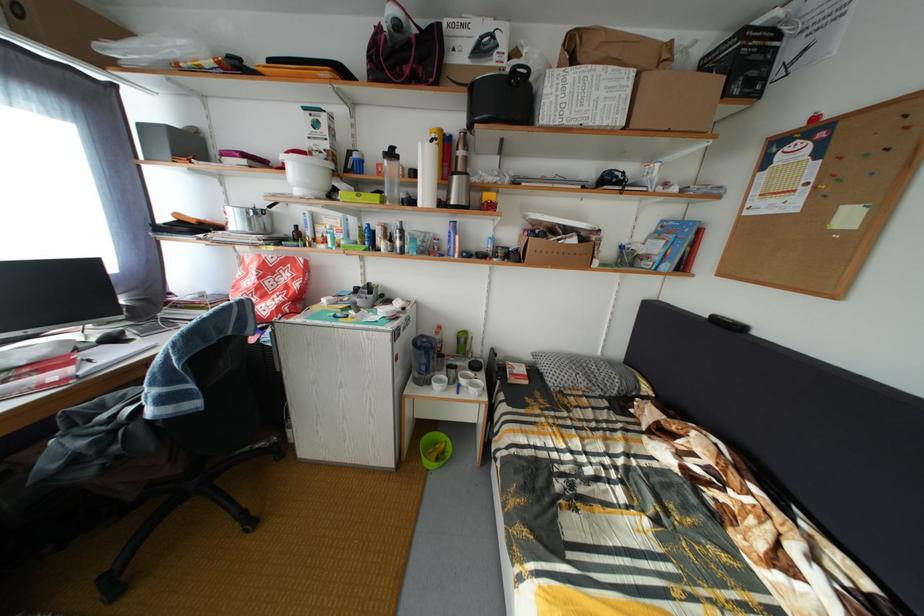
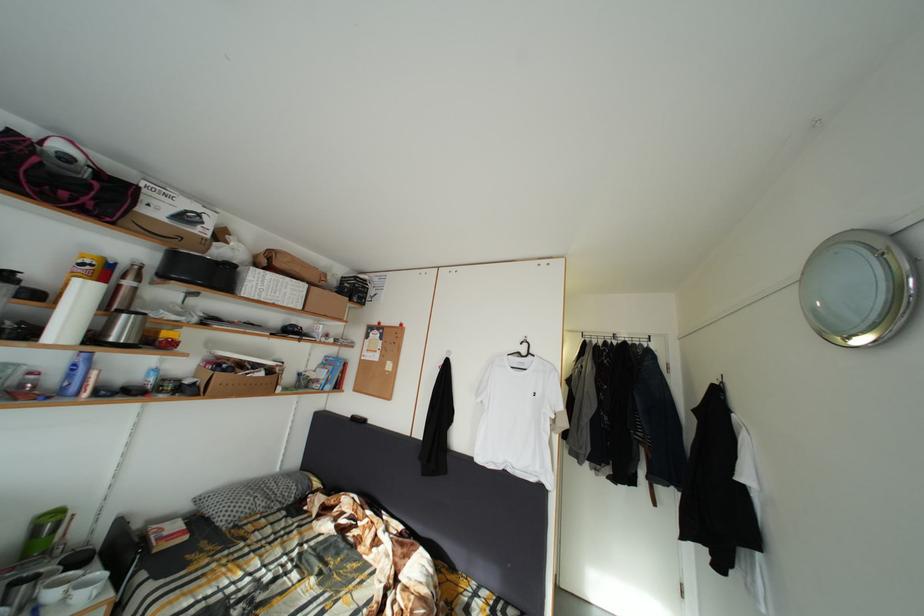
Find the pixel in the second image that matches (469,153) in the first image.

(140, 283)